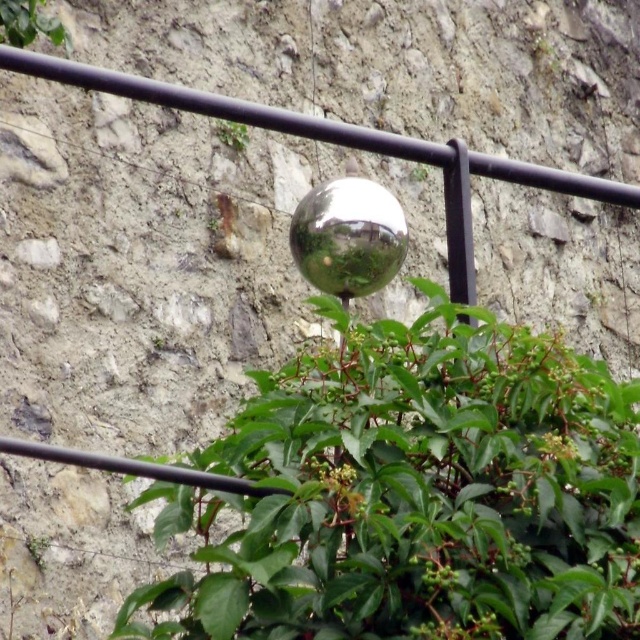
Question: Is shiny metallic sphere at center further to the viewer compared to green leafy plant at upper left?

Choices:
 (A) no
 (B) yes

Answer: (A)

Question: Does green leafy bush at center appear over green leafy plant at upper center?

Choices:
 (A) yes
 (B) no

Answer: (B)

Question: Which point appears farthest from the camera in this image?

Choices:
 (A) (28, 540)
 (B) (532, 604)
 (C) (32, 22)

Answer: (C)

Question: Which object appears farthest from the camera in this image?

Choices:
 (A) green leafy bush at center
 (B) shiny metallic sphere at center
 (C) green leafy plant at upper left

Answer: (C)

Question: Does green leafy plant at upper left appear under green leafy plant at lower left?

Choices:
 (A) no
 (B) yes

Answer: (A)

Question: Among these points, which one is farthest from the camera?

Choices:
 (A) (38, 541)
 (B) (246, 140)

Answer: (B)